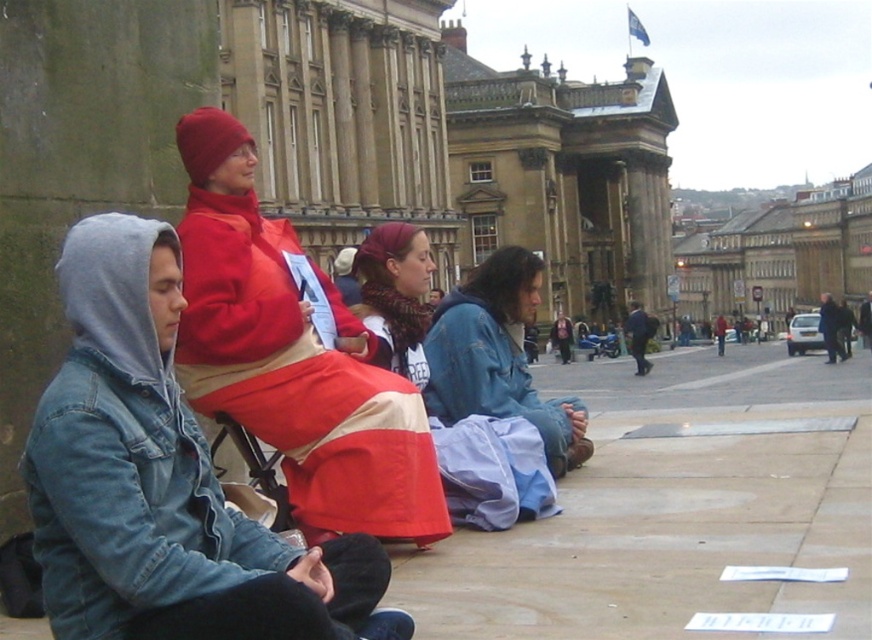
Question: Which point appears closest to the camera in this image?

Choices:
 (A) [x=120, y=422]
 (B) [x=390, y=356]
 (C) [x=522, y=305]
 (D) [x=210, y=250]

Answer: (A)

Question: Which point is farther to the camera?

Choices:
 (A) (390, 285)
 (B) (469, 305)
 (C) (321, 609)

Answer: (B)

Question: Does denim jacket at left have a greater width compared to blue denim jacket at center?

Choices:
 (A) no
 (B) yes

Answer: (B)

Question: Is matte red coat at center smaller than blue denim jacket at center?

Choices:
 (A) yes
 (B) no

Answer: (A)

Question: Which of the following is the farthest from the observer?

Choices:
 (A) denim jacket at left
 (B) knitted red scarf at center
 (C) matte red coat at center
 (D) blue denim jacket at center

Answer: (D)

Question: Does blue denim jacket at center appear on the left side of knitted red scarf at center?

Choices:
 (A) no
 (B) yes

Answer: (A)